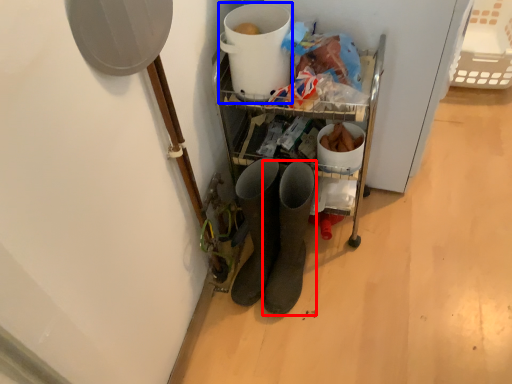
Question: Which object is further to the camera taking this photo, footwear (highlighted by a red box) or appliance (highlighted by a blue box)?

Choices:
 (A) footwear
 (B) appliance

Answer: (B)